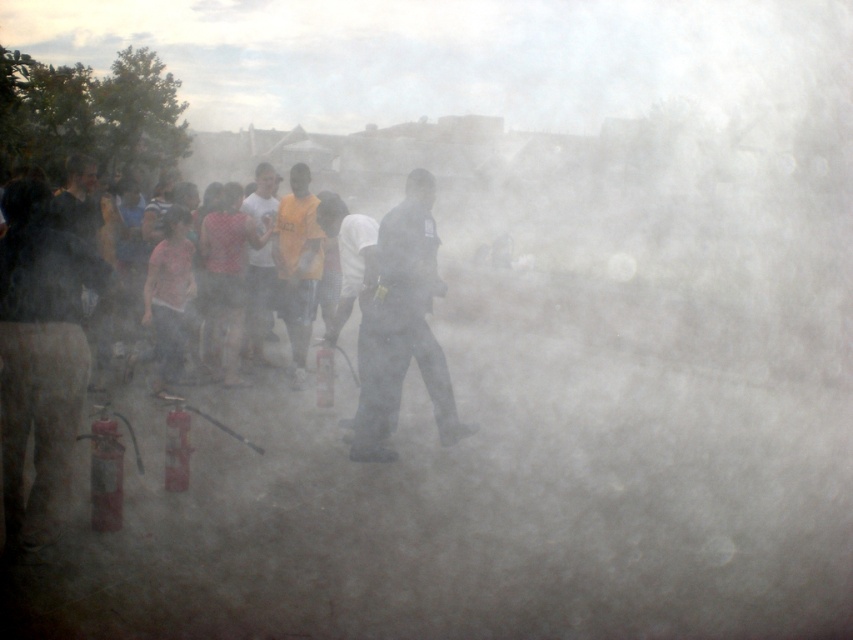
You are a safety inspector observing a fire drill. You notice two individuals at the center of the scene, a dark uniformed figure at center and a white matte shirt at center. Which one is standing in front of the other?

The dark uniformed figure at center is positioned under the white matte shirt at center, meaning the white matte shirt at center is standing in front of the dark uniformed figure at center.

You are a drone operator trying to locate a specific individual in a smoky environment. You have a map with coordinates. Where is the dark uniformed figure at center located in terms of coordinates?

The dark uniformed figure at center is located at coordinates point (402, 326).